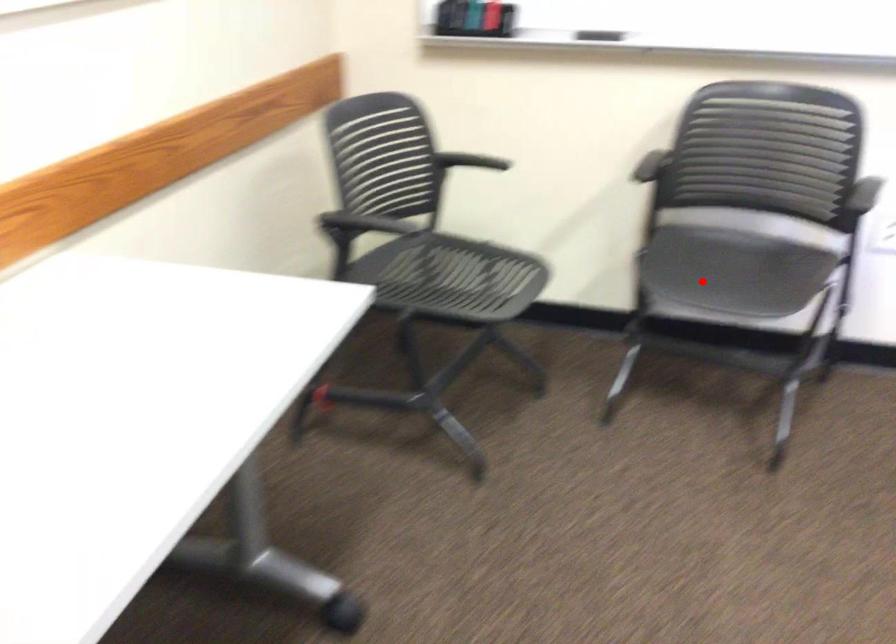
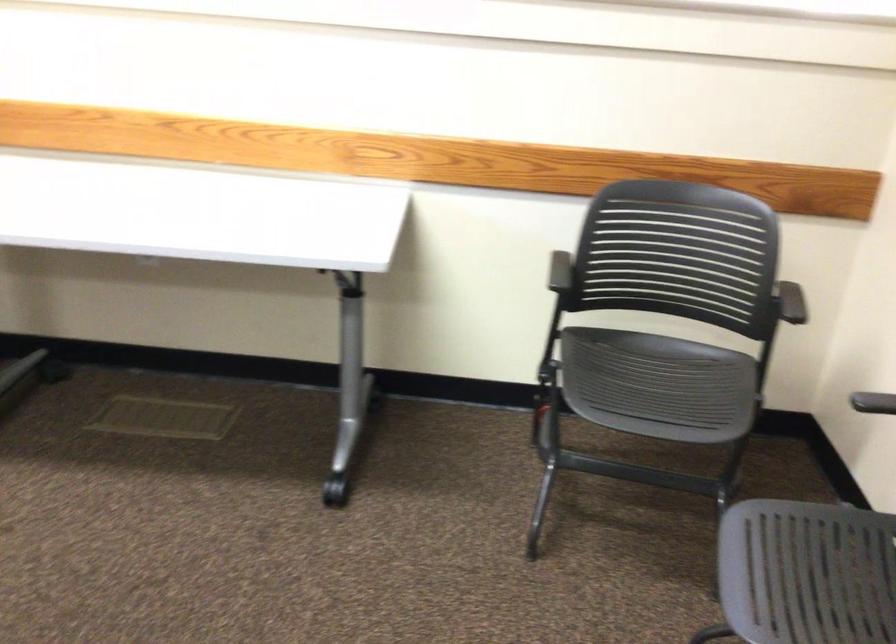
Locate, in the second image, the point that corresponds to the highlighted location in the first image.

(806, 573)